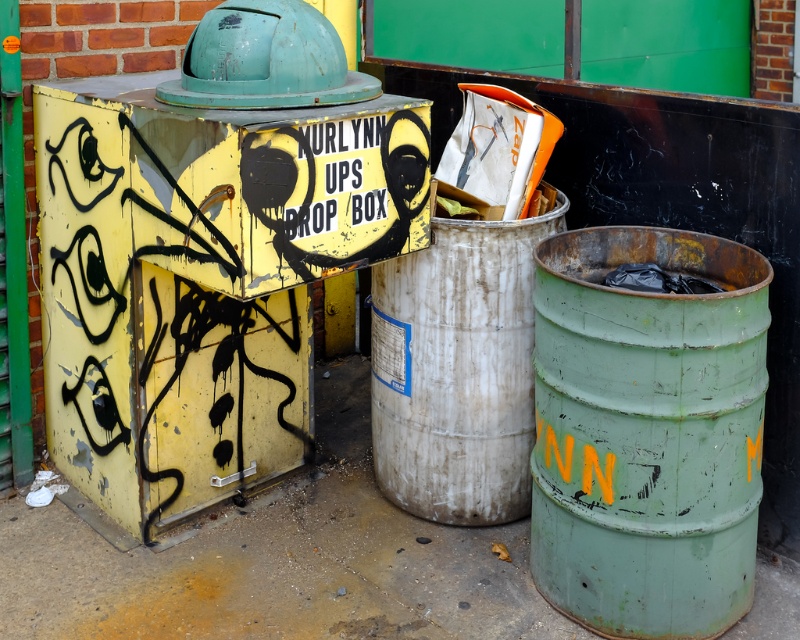
You are a delivery person trying to place a package between the green painted metal barrel at right and the rusty metallic barrel at center. The package is 50 centimeters long. Will it fit in the space between them?

The distance between the green painted metal barrel at right and the rusty metallic barrel at center is 48.98 centimeters. Since the package is 50 centimeters long, it will not fit in the space between them.

You are a delivery person trying to place a package between the green painted metal barrel at right and the rusty metallic barrel at center. Can you fit the package if it is 1.2 meters wide?

The green painted metal barrel at right is wider than the rusty metallic barrel at center. Since the package is 1.2 meters wide, it depends on the exact width of the space between them. However, the description only states the relative sizes of the barrels, not the distance between them. Without knowing the distance between the two barrels, it is impossible to determine if the package will fit.

You are a delivery person trying to locate the UPS drop box. From your current position, which direction should you move to first reach the green painted metal barrel at right and then the rusty metallic barrel at center?

First, you should go to the rusty metallic barrel at center since it is closer to your starting position. After that, move to the green painted metal barrel at right, which is positioned to the right of the rusty metallic barrel at center.